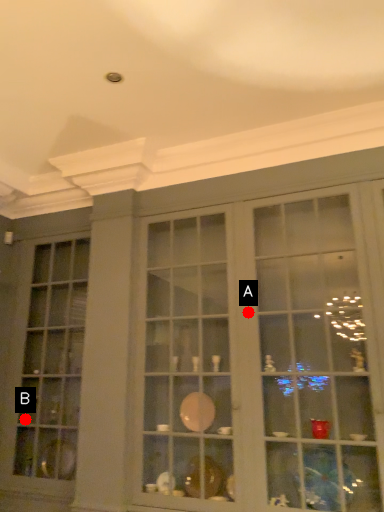
Question: Two points are circled on the image, labeled by A and B beside each circle. Among these points, which one is nearest to the camera?

Choices:
 (A) A is closer
 (B) B is closer

Answer: (A)